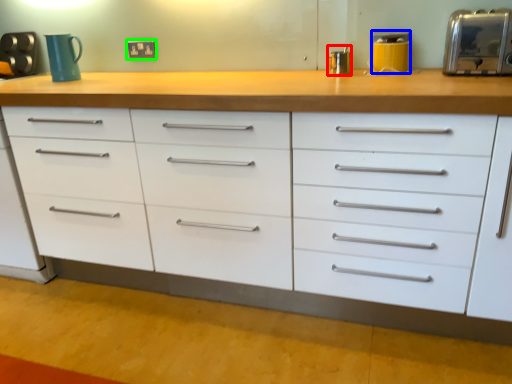
Question: Which is nearer to the appliance (highlighted by a red box)? appliance (highlighted by a blue box) or electric outlet (highlighted by a green box).

Choices:
 (A) appliance
 (B) electric outlet

Answer: (A)